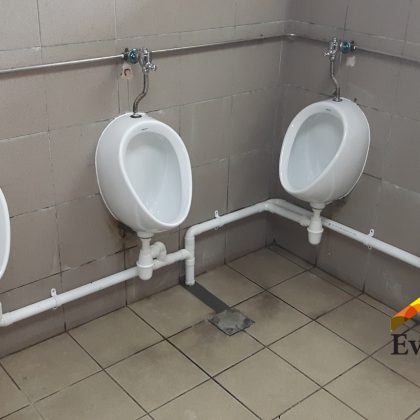
I want to click on dirty areas on floor tile, so click(x=268, y=313), click(x=302, y=266), click(x=198, y=333), click(x=152, y=354), click(x=337, y=281), click(x=280, y=251), click(x=316, y=314).